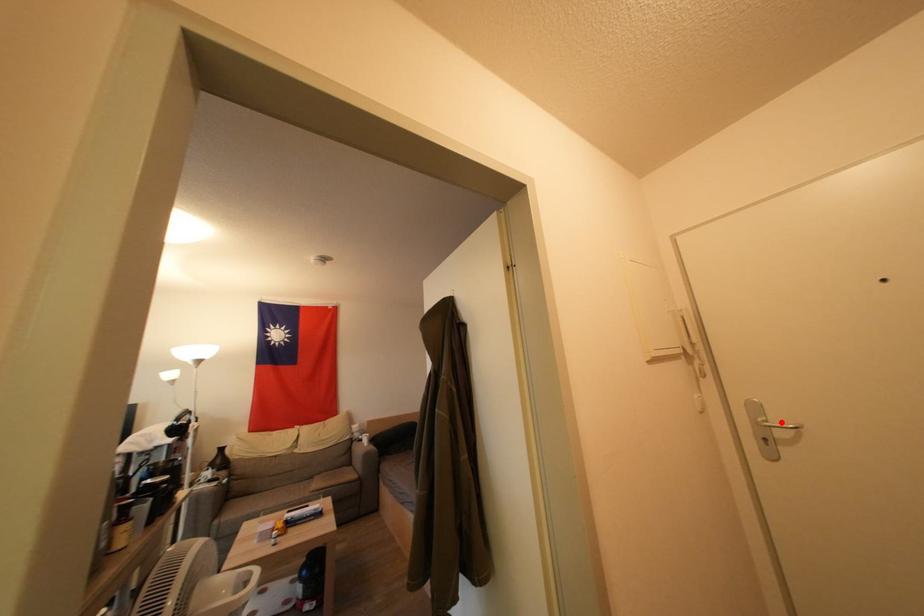
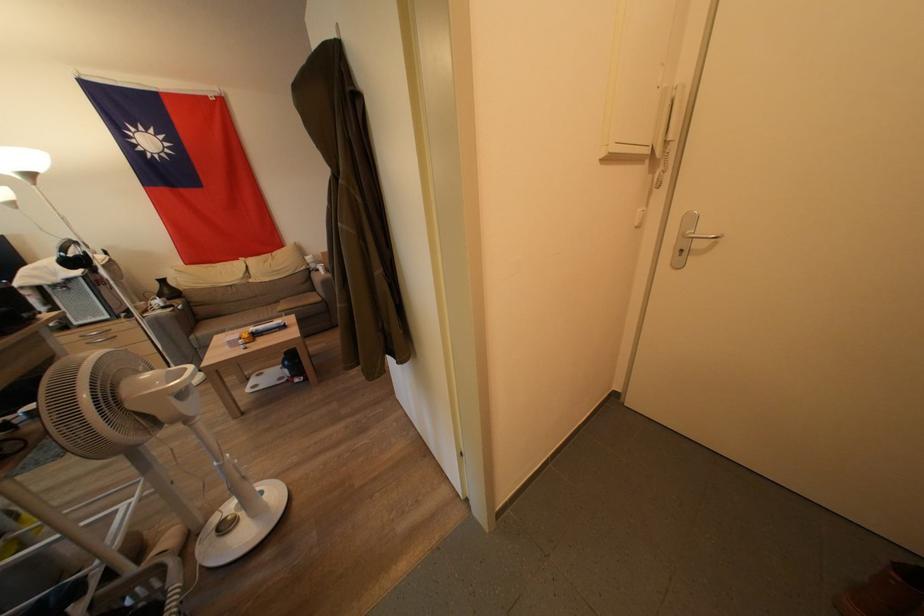
Locate, in the second image, the point that corresponds to the highlighted location in the first image.

(710, 233)